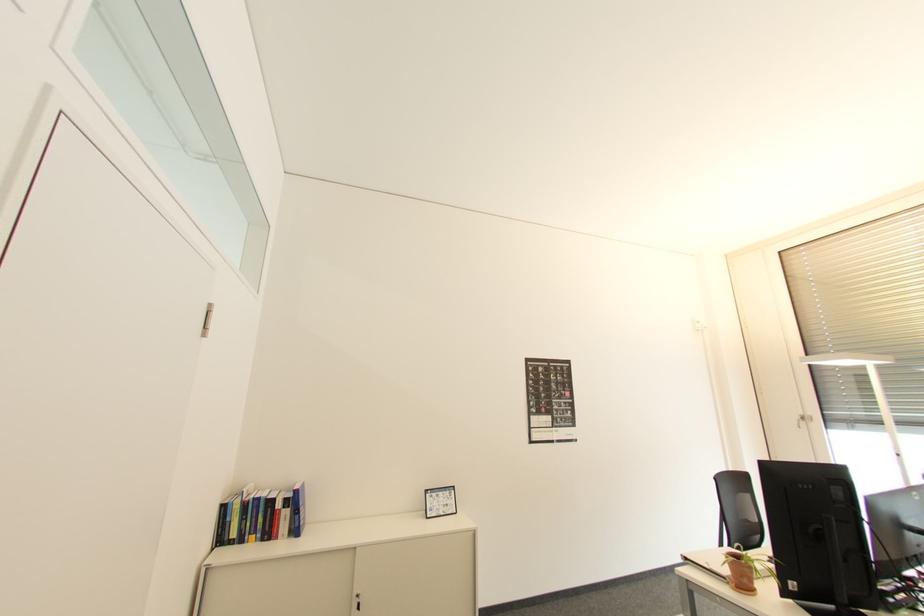
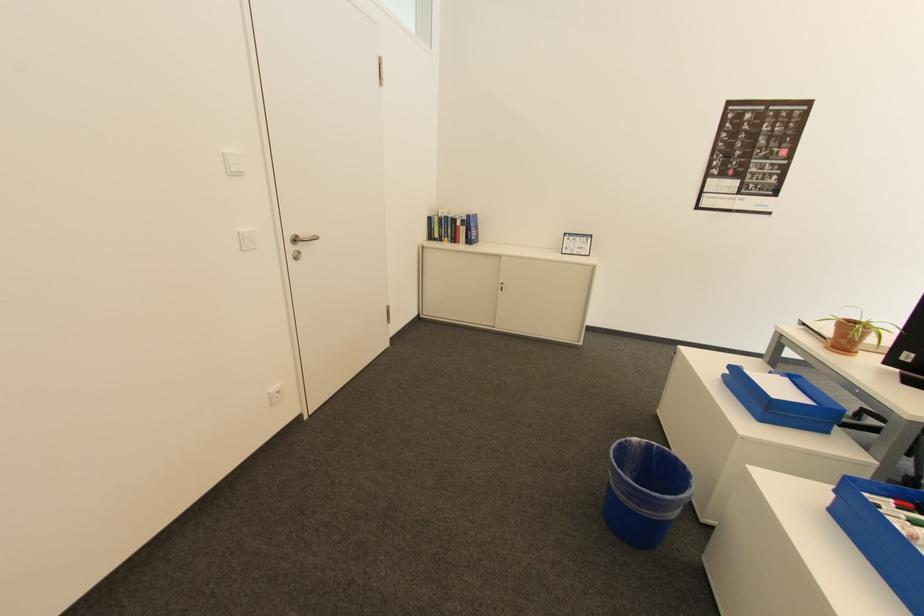
The images are taken continuously from a first-person perspective. In which direction is your viewpoint rotating?

The rotation direction of the camera is left-down.